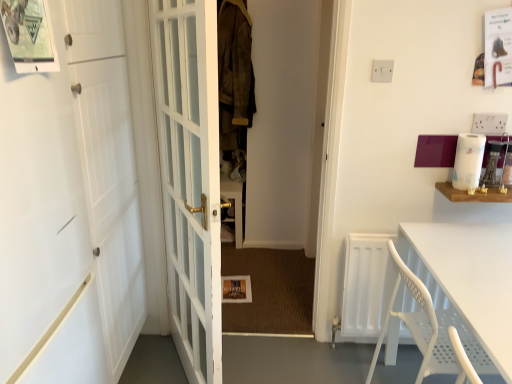
Question: From a real-world perspective, is white paper towel at upper right beneath white plastic table at lower right?

Choices:
 (A) no
 (B) yes

Answer: (A)

Question: Is white paper towel at upper right not near white plastic table at lower right?

Choices:
 (A) yes
 (B) no

Answer: (B)

Question: Does white paper towel at upper right have a lesser width compared to white plastic table at lower right?

Choices:
 (A) no
 (B) yes

Answer: (B)

Question: Is white paper towel at upper right closer to camera compared to white plastic table at lower right?

Choices:
 (A) yes
 (B) no

Answer: (B)

Question: Does white paper towel at upper right have a smaller size compared to white plastic table at lower right?

Choices:
 (A) no
 (B) yes

Answer: (B)

Question: Does white paper towel at upper right have a larger size compared to white plastic table at lower right?

Choices:
 (A) yes
 (B) no

Answer: (B)

Question: From a real-world perspective, is suede jacket at center on top of white glass door at center, acting as the 2th door starting from the left?

Choices:
 (A) no
 (B) yes

Answer: (B)

Question: Does suede jacket at center turn towards white glass door at center, acting as the 2th door starting from the left?

Choices:
 (A) no
 (B) yes

Answer: (B)

Question: Considering the relative sizes of suede jacket at center and white glass door at center, placed as the 1th door when sorted from right to left, in the image provided, is suede jacket at center thinner than white glass door at center, placed as the 1th door when sorted from right to left,?

Choices:
 (A) yes
 (B) no

Answer: (B)

Question: Considering the relative sizes of suede jacket at center and white glass door at center, acting as the 2th door starting from the left, in the image provided, is suede jacket at center bigger than white glass door at center, acting as the 2th door starting from the left,?

Choices:
 (A) no
 (B) yes

Answer: (A)

Question: Is suede jacket at center far from white glass door at center, acting as the 2th door starting from the left?

Choices:
 (A) no
 (B) yes

Answer: (B)

Question: Is suede jacket at center positioned with its back to white glass door at center, acting as the 2th door starting from the left?

Choices:
 (A) no
 (B) yes

Answer: (A)

Question: Can you confirm if white plastic table at lower right is shorter than white matte door at left, placed as the second door when sorted from right to left?

Choices:
 (A) no
 (B) yes

Answer: (B)